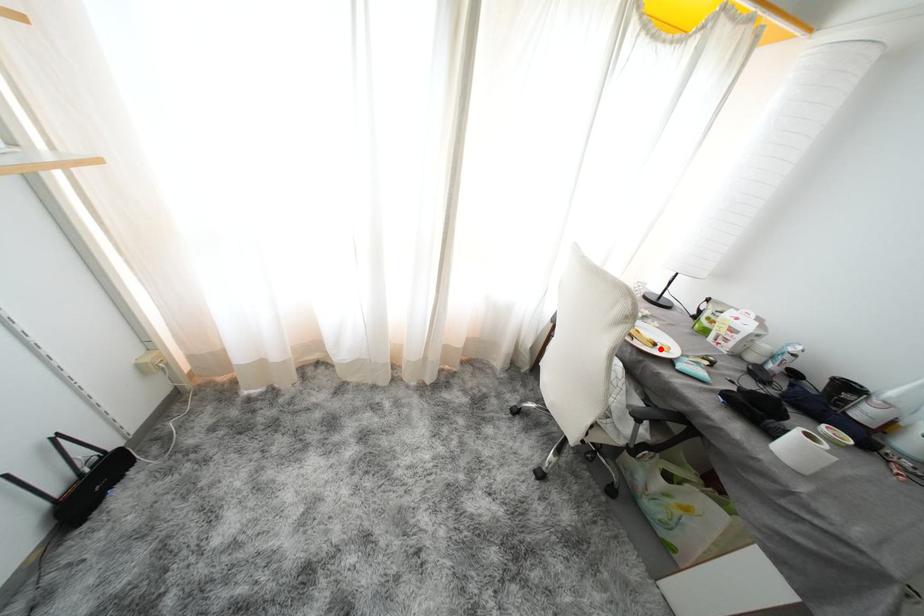
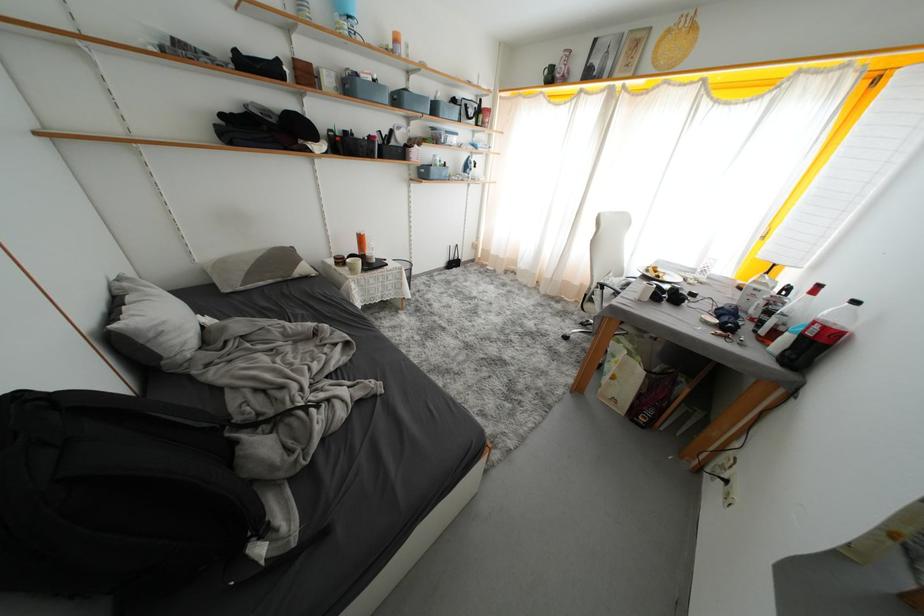
In the second image, find the point that corresponds to the highlighted location in the first image.

(664, 281)